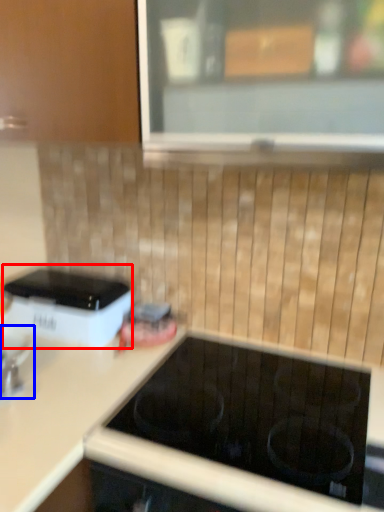
Question: Among these objects, which one is farthest to the camera, home appliance (highlighted by a red box) or appliance (highlighted by a blue box)?

Choices:
 (A) home appliance
 (B) appliance

Answer: (A)